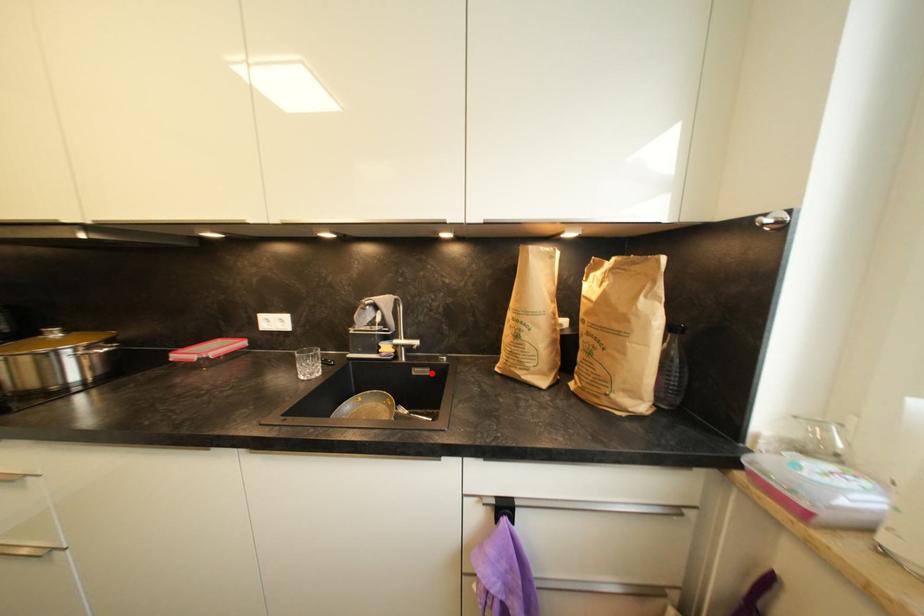
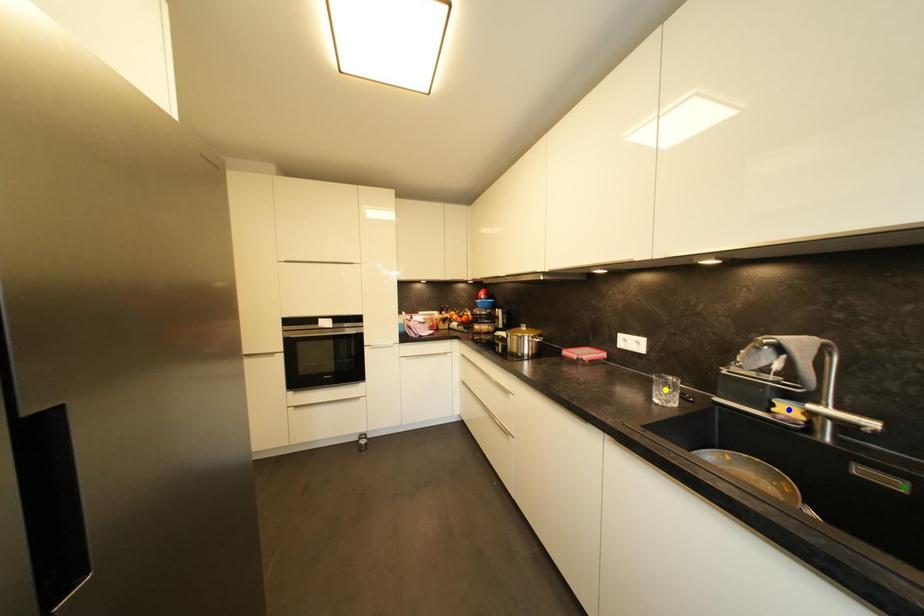
Question: I am providing you with two images of the same scene from different viewpoints. A red point is marked on the first image. You are given multiple points on the second image. Which spot in image 2 lines up with the point in image 1?

Choices:
 (A) yellow point
 (B) green point
 (C) blue point

Answer: (B)